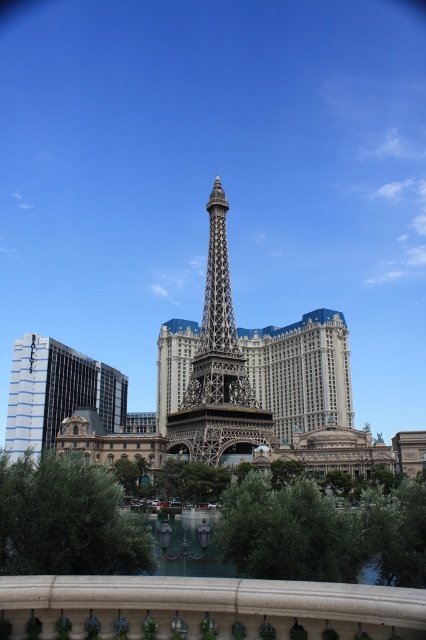
Can you confirm if metallic gold eiffel tower at center is bigger than glassy blue skyscraper at left?

No, metallic gold eiffel tower at center is not bigger than glassy blue skyscraper at left.

Does metallic gold eiffel tower at center appear on the left side of glassy blue skyscraper at left?

In fact, metallic gold eiffel tower at center is to the right of glassy blue skyscraper at left.

Find the location of a particular element. The width and height of the screenshot is (426, 640). metallic gold eiffel tower at center is located at coordinates (218, 368).

Is white stone balustrade at lower center to the right of glassy blue skyscraper at left from the viewer's perspective?

Correct, you'll find white stone balustrade at lower center to the right of glassy blue skyscraper at left.

Is point (207, 580) positioned behind point (20, 372)?

No, it is not.

Does point (393, 621) come closer to viewer compared to point (31, 349)?

Yes, it is in front of point (31, 349).

This screenshot has height=640, width=426. What are the coordinates of `white stone balustrade at lower center` in the screenshot? It's located at (210, 605).

Can you confirm if white stone balustrade at lower center is positioned below metallic gold eiffel tower at center?

Yes, white stone balustrade at lower center is below metallic gold eiffel tower at center.

Is white stone balustrade at lower center shorter than metallic gold eiffel tower at center?

Yes.

Locate an element on the screen. white stone balustrade at lower center is located at coordinates (210, 605).

The width and height of the screenshot is (426, 640). Find the location of `white stone balustrade at lower center`. white stone balustrade at lower center is located at coordinates (210, 605).